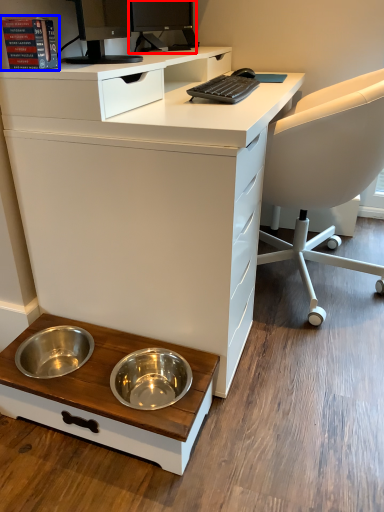
Question: Which of the following is the farthest to the observer, desktop computer (highlighted by a red box) or book (highlighted by a blue box)?

Choices:
 (A) desktop computer
 (B) book

Answer: (A)